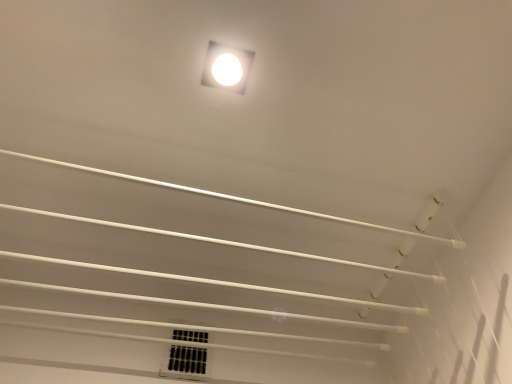
Question: In terms of height, does white glossy square at upper center look taller or shorter compared to white plastic vent at lower center?

Choices:
 (A) short
 (B) tall

Answer: (A)

Question: From a real-world perspective, is white glossy square at upper center physically located above or below white plastic vent at lower center?

Choices:
 (A) below
 (B) above

Answer: (B)

Question: Considering their positions, is white glossy square at upper center located in front of or behind white plastic vent at lower center?

Choices:
 (A) front
 (B) behind

Answer: (A)

Question: Based on their sizes in the image, would you say white plastic vent at lower center is bigger or smaller than white glossy square at upper center?

Choices:
 (A) big
 (B) small

Answer: (A)

Question: From their relative heights in the image, would you say white plastic vent at lower center is taller or shorter than white glossy square at upper center?

Choices:
 (A) tall
 (B) short

Answer: (A)

Question: From a real-world perspective, is white plastic vent at lower center physically located above or below white glossy square at upper center?

Choices:
 (A) above
 (B) below

Answer: (B)

Question: Looking at their shapes, would you say white plastic vent at lower center is wider or thinner than white glossy square at upper center?

Choices:
 (A) wide
 (B) thin

Answer: (B)